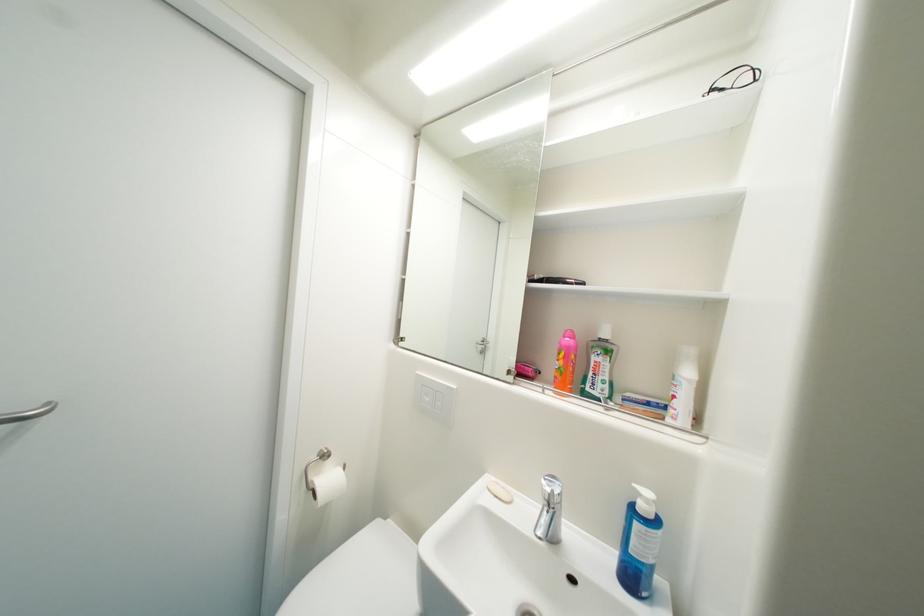
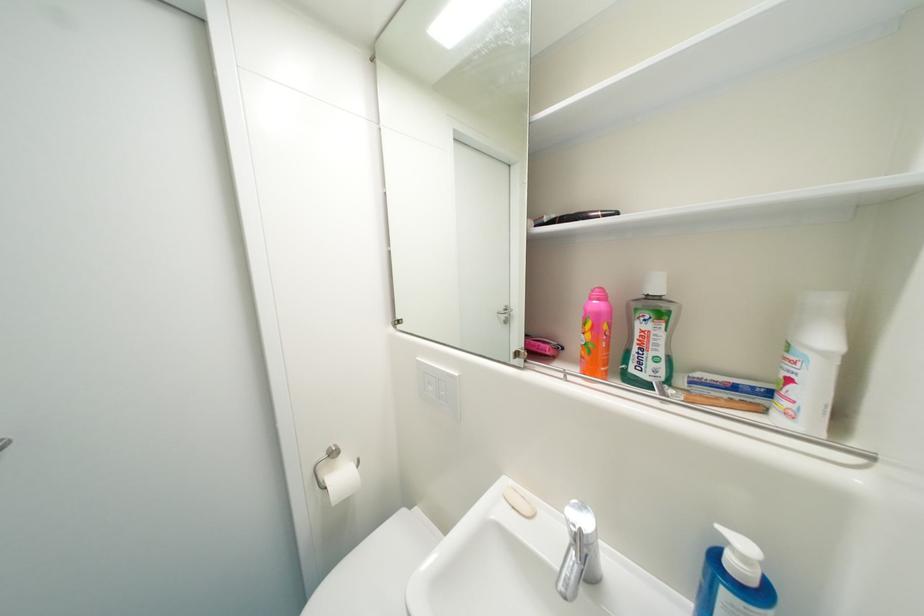
Question: How did the camera likely rotate?

Choices:
 (A) Left
 (B) Right
 (C) Up
 (D) Down

Answer: (A)